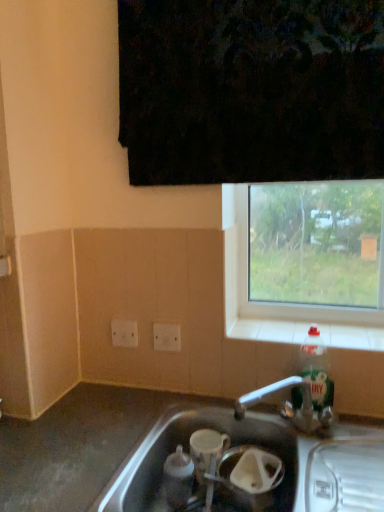
Question: From their relative heights in the image, would you say silver metallic sink at lower center is taller or shorter than white tile at lower right?

Choices:
 (A) tall
 (B) short

Answer: (A)

Question: Is silver metallic sink at lower center wider or thinner than white tile at lower right?

Choices:
 (A) wide
 (B) thin

Answer: (A)

Question: Estimate the real-world distances between objects in this image. Which object is closer to the clear glass window at upper right?

Choices:
 (A) translucent plastic bottle at right
 (B) white plastic electric outlet at lower left, the 2th electric outlet when ordered from front to back
 (C) silver metallic sink at lower center
 (D) white plastic electric outlet at center, the 1th electric outlet when ordered from right to left
 (E) white tile at lower right

Answer: (E)

Question: Estimate the real-world distances between objects in this image. Which object is closer to the white tile at lower right?

Choices:
 (A) white plastic electric outlet at lower left, which is counted as the 1th electric outlet, starting from the left
 (B) translucent plastic bottle at right
 (C) white plastic electric outlet at center, which appears as the first electric outlet when viewed from the front
 (D) clear glass window at upper right
 (E) silver metallic sink at lower center

Answer: (B)